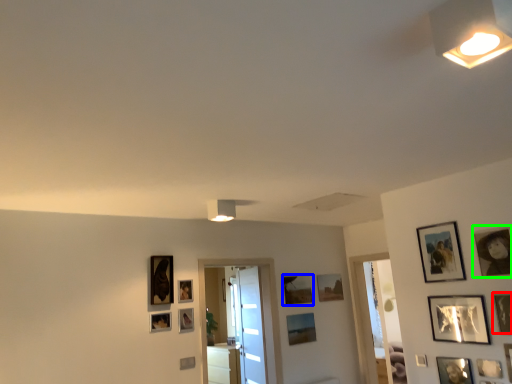
Question: Which object is the closest to the picture frame (highlighted by a red box)? Choose among these: picture frame (highlighted by a blue box) or picture frame (highlighted by a green box).

Choices:
 (A) picture frame
 (B) picture frame

Answer: (B)